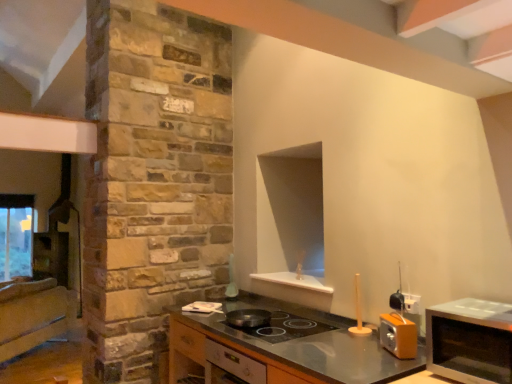
Question: Is satin silver microwave at right at the right side of metallic gray countertop at center?

Choices:
 (A) no
 (B) yes

Answer: (B)

Question: Is satin silver microwave at right to the left of metallic gray countertop at center from the viewer's perspective?

Choices:
 (A) no
 (B) yes

Answer: (A)

Question: Considering the relative sizes of satin silver microwave at right and metallic gray countertop at center in the image provided, is satin silver microwave at right bigger than metallic gray countertop at center?

Choices:
 (A) no
 (B) yes

Answer: (A)

Question: Is metallic gray countertop at center inside satin silver microwave at right?

Choices:
 (A) no
 (B) yes

Answer: (A)

Question: Can you confirm if satin silver microwave at right is wider than metallic gray countertop at center?

Choices:
 (A) no
 (B) yes

Answer: (A)

Question: Does satin silver microwave at right have a smaller size compared to metallic gray countertop at center?

Choices:
 (A) yes
 (B) no

Answer: (A)

Question: Considering the relative positions of shiny black frying pan at center and wooden cabinet at left, the 2th cabinetry in the front-to-back sequence, in the image provided, is shiny black frying pan at center to the right of wooden cabinet at left, the 2th cabinetry in the front-to-back sequence, from the viewer's perspective?

Choices:
 (A) no
 (B) yes

Answer: (B)

Question: Is shiny black frying pan at center surrounding wooden cabinet at left, positioned as the first cabinetry in left-to-right order?

Choices:
 (A) yes
 (B) no

Answer: (B)

Question: Is shiny black frying pan at center closer to camera compared to wooden cabinet at left, the 2th cabinetry in the front-to-back sequence?

Choices:
 (A) yes
 (B) no

Answer: (A)

Question: From a real-world perspective, is shiny black frying pan at center beneath wooden cabinet at left, which ranks as the 1th cabinetry in back-to-front order?

Choices:
 (A) no
 (B) yes

Answer: (A)

Question: Is shiny black frying pan at center positioned beyond the bounds of wooden cabinet at left, the 2th cabinetry viewed from the right?

Choices:
 (A) no
 (B) yes

Answer: (B)

Question: Does shiny black frying pan at center come behind wooden cabinet at left, the 2th cabinetry viewed from the right?

Choices:
 (A) no
 (B) yes

Answer: (A)

Question: From a real-world perspective, is shiny black frying pan at center beneath satin silver microwave at right?

Choices:
 (A) yes
 (B) no

Answer: (A)